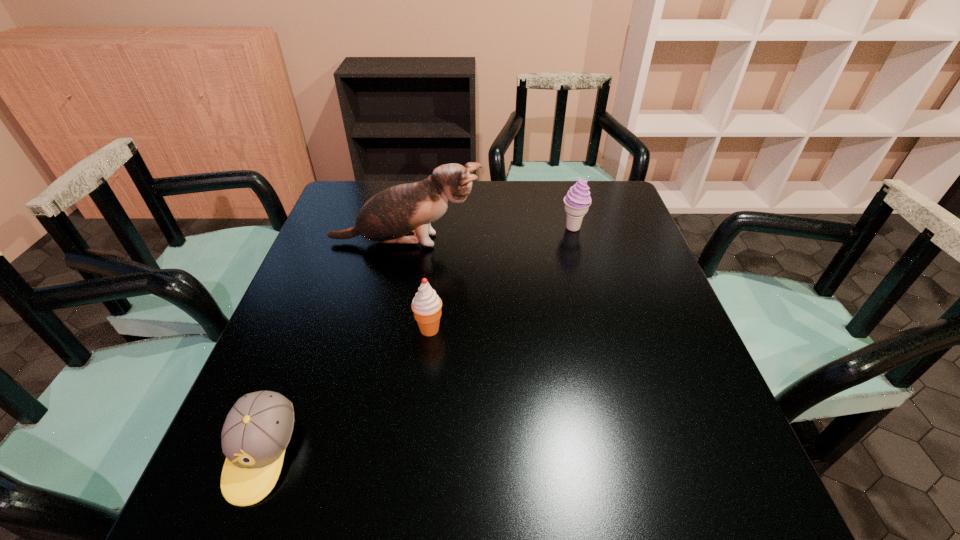
Image resolution: width=960 pixels, height=540 pixels. What are the coordinates of `vacant space at the right edge of the desktop` in the screenshot? It's located at (599, 226).

Image resolution: width=960 pixels, height=540 pixels. Find the location of `free space at the near right corner of the desktop`. free space at the near right corner of the desktop is located at coordinates (722, 485).

Where is `empty location between the nearest object and the second nearest object`? empty location between the nearest object and the second nearest object is located at coordinates (346, 392).

Find the location of a particular element. This screenshot has width=960, height=540. vacant area between the cat and the right icecream is located at coordinates (490, 235).

Where is `free spot between the tallest object and the shortest object`? The height and width of the screenshot is (540, 960). free spot between the tallest object and the shortest object is located at coordinates (334, 348).

Where is `unoccupied position between the cat and the rightmost object`? unoccupied position between the cat and the rightmost object is located at coordinates (490, 235).

Identify the location of free space that is in between the nearest object and the right icecream. 418,341.

Find the location of a particular element. free spot between the tallest object and the left icecream is located at coordinates (418, 286).

This screenshot has height=540, width=960. Identify the location of empty space that is in between the shortest object and the left icecream. (346, 392).

I want to click on vacant area that lies between the rightmost object and the cat, so click(490, 235).